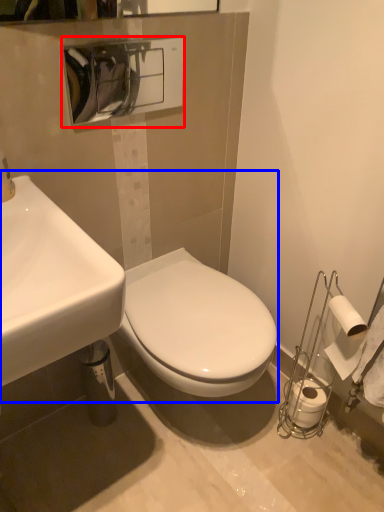
Question: Which of the following is the farthest to the observer, hand dryer (highlighted by a red box) or sink (highlighted by a blue box)?

Choices:
 (A) hand dryer
 (B) sink

Answer: (A)